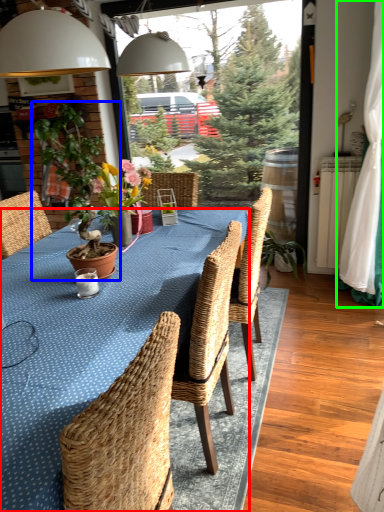
Question: Considering the real-world distances, which object is farthest from kitchen & dining room table (highlighted by a red box)? houseplant (highlighted by a blue box) or curtain (highlighted by a green box)?

Choices:
 (A) houseplant
 (B) curtain

Answer: (B)